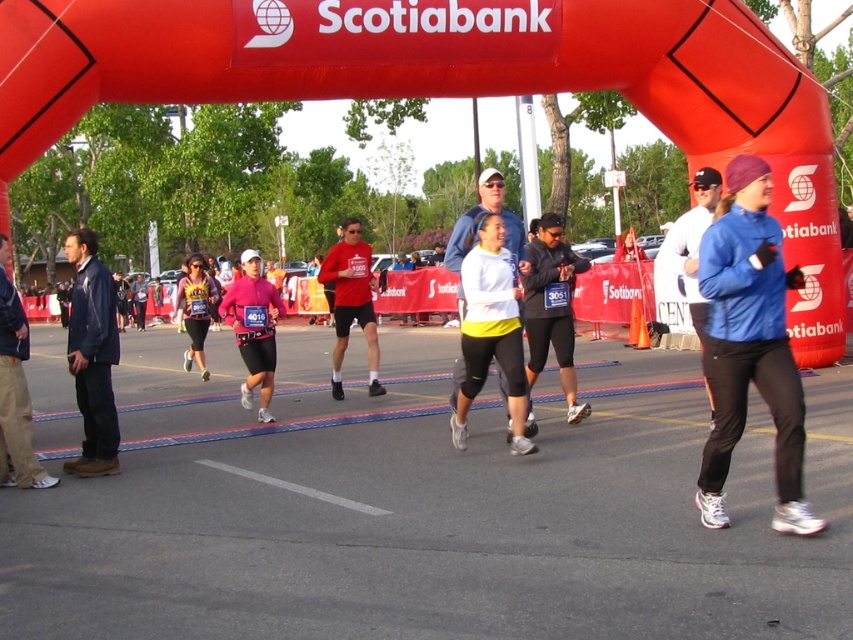
The height and width of the screenshot is (640, 853). What do you see at coordinates (749, 346) in the screenshot? I see `blue matte jacket at center` at bounding box center [749, 346].

Locate an element on the screen. The height and width of the screenshot is (640, 853). blue matte jacket at center is located at coordinates (749, 346).

What do you see at coordinates (749, 346) in the screenshot? The image size is (853, 640). I see `blue matte jacket at center` at bounding box center [749, 346].

Is point (708, 378) more distant than point (490, 284)?

No, it is not.

I want to click on blue matte jacket at center, so click(x=749, y=346).

Is white matte running top at center smaller than matte pink leggings at center?

Correct, white matte running top at center occupies less space than matte pink leggings at center.

Who is more distant from viewer, (500, 291) or (192, 355)?

Positioned behind is point (192, 355).

Locate an element on the screen. white matte running top at center is located at coordinates (491, 330).